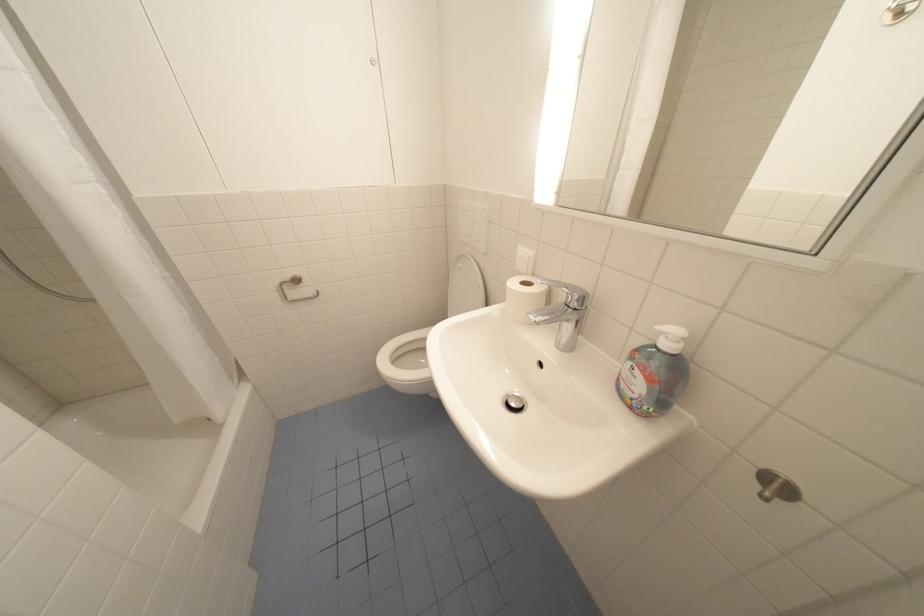
Where is `sink drain plug`? Image resolution: width=924 pixels, height=616 pixels. sink drain plug is located at coordinates (514, 402).